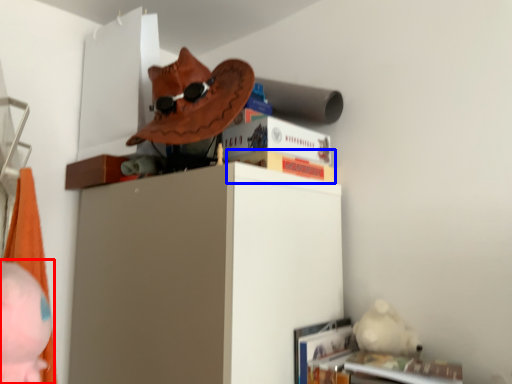
Question: Which object is closer to the camera taking this photo, person (highlighted by a red box) or paperback book (highlighted by a blue box)?

Choices:
 (A) person
 (B) paperback book

Answer: (A)